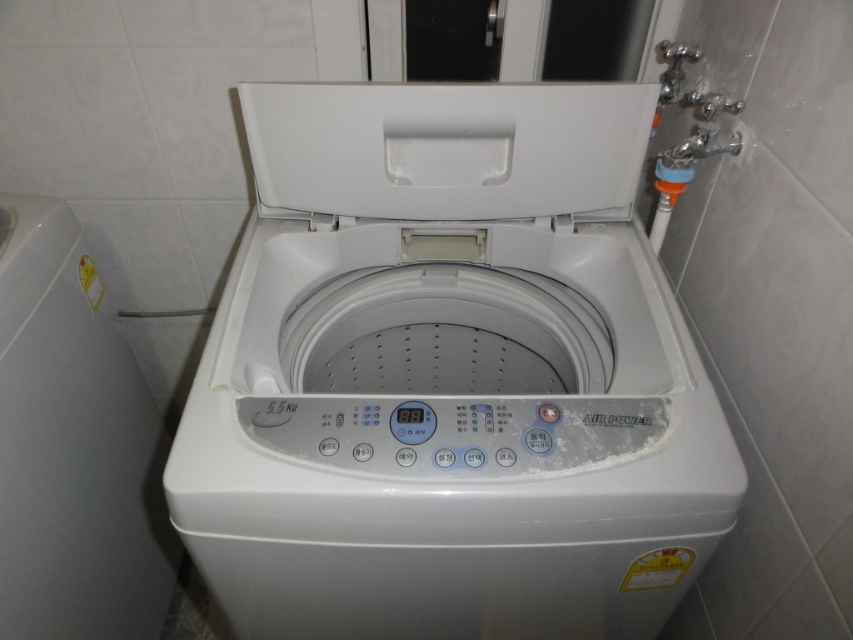
Who is higher up, white plastic washing machine at center or white plastic washing machine at lower left?

white plastic washing machine at center

What do you see at coordinates (448, 376) in the screenshot? The height and width of the screenshot is (640, 853). I see `white plastic washing machine at center` at bounding box center [448, 376].

Locate an element on the screen. Image resolution: width=853 pixels, height=640 pixels. white plastic washing machine at center is located at coordinates (448, 376).

Which is in front, point (125, 602) or point (502, 173)?

Positioned in front is point (502, 173).

Is point (19, 220) positioned in front of point (438, 154)?

Yes, it is in front of point (438, 154).

In order to click on white plastic washing machine at lower left in this screenshot , I will do `click(73, 445)`.

Between point (450, 230) and point (273, 97), which one is positioned behind?

The point (450, 230) is behind.

I want to click on white plastic washing machine at center, so click(x=448, y=376).

Identify the location of white plastic washing machine at center. This screenshot has width=853, height=640. (448, 376).